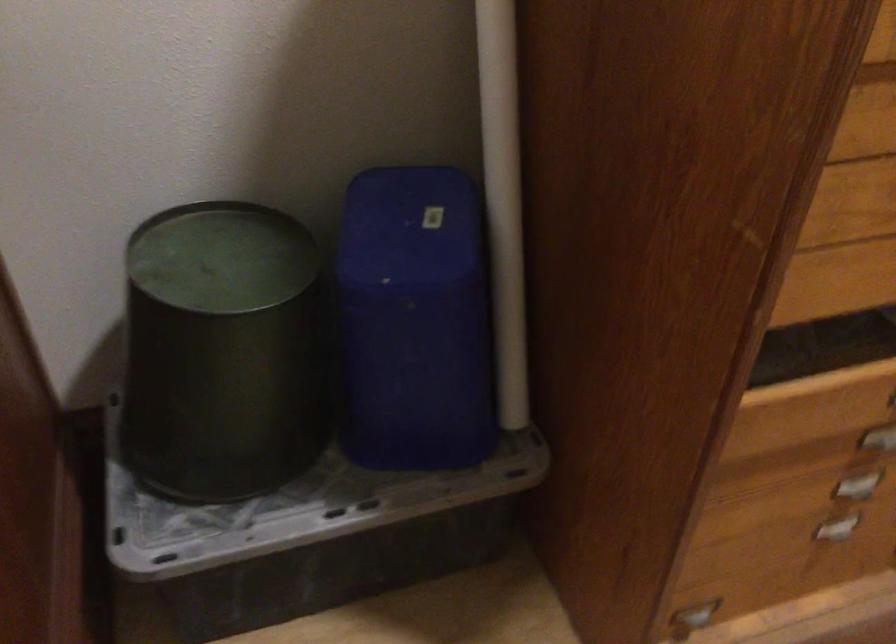
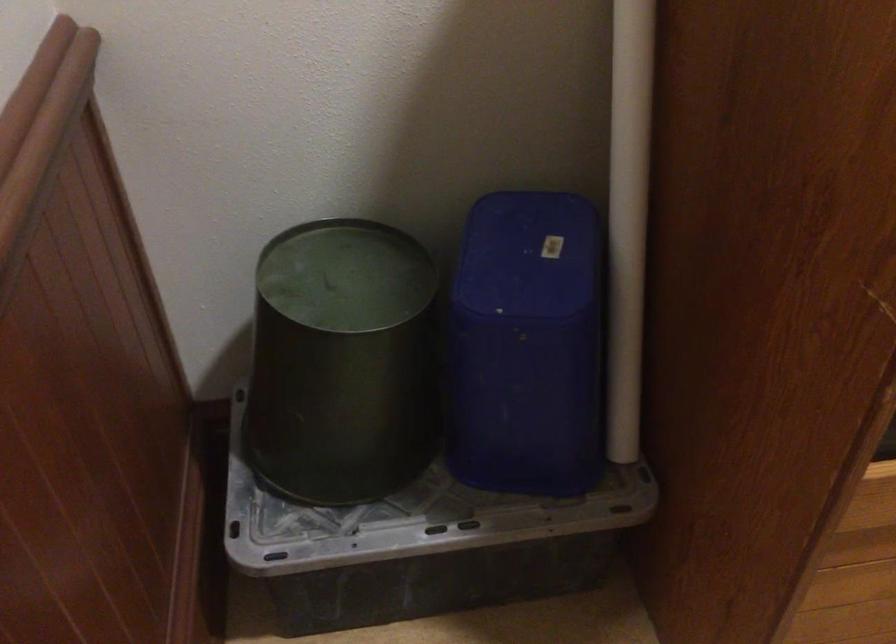
Locate, in the second image, the point that corresponds to pixel 409 228 in the first image.

(529, 254)